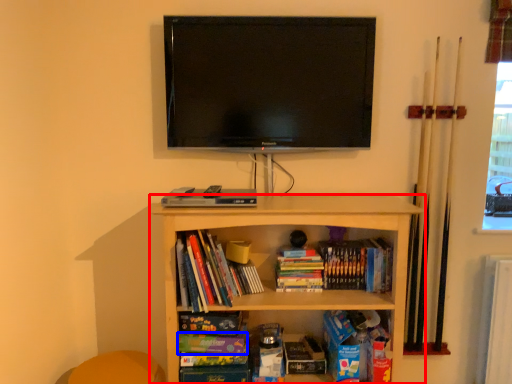
Question: Which object is closer to the camera taking this photo, shelf (highlighted by a red box) or paperback book (highlighted by a blue box)?

Choices:
 (A) shelf
 (B) paperback book

Answer: (A)